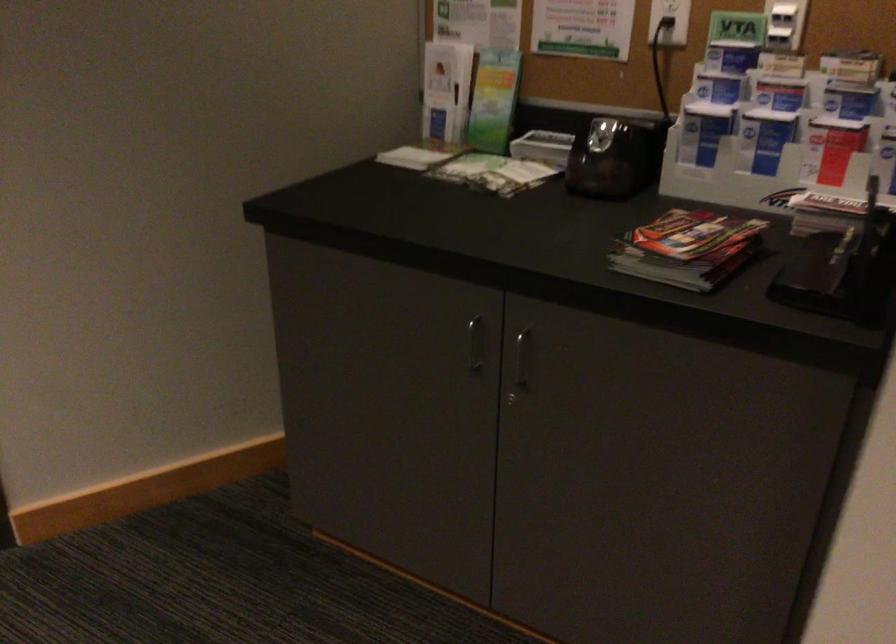
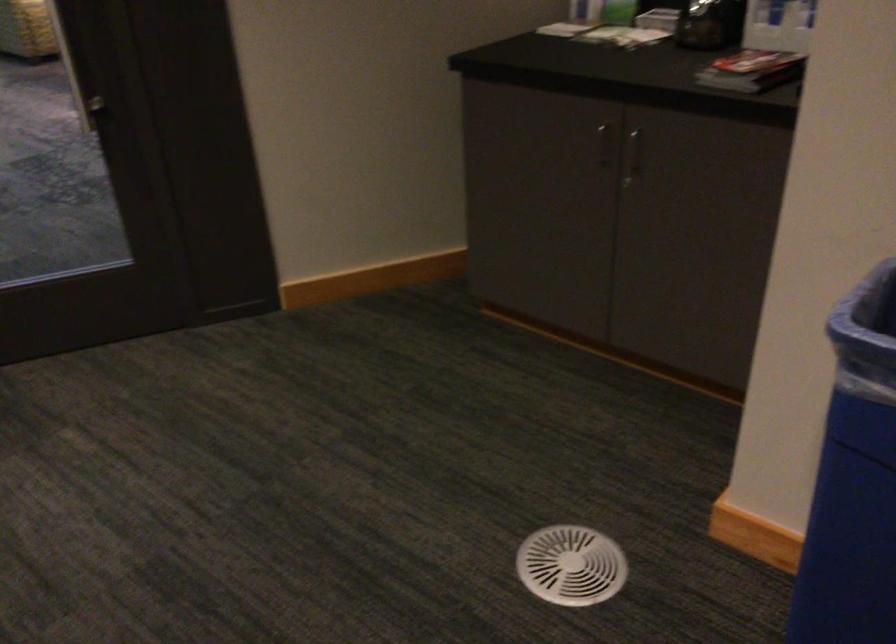
Locate, in the second image, the point that corresponds to point 522,366 in the first image.

(633, 155)